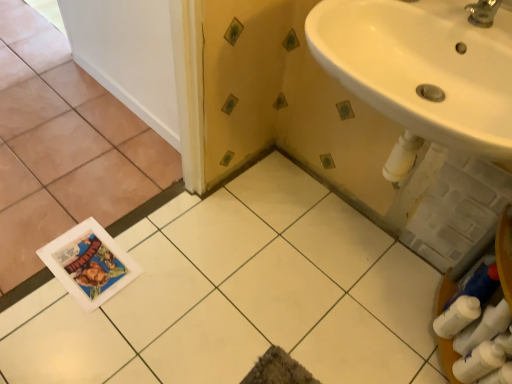
The width and height of the screenshot is (512, 384). Find the location of `free spot below white glossy sink at upper right (from a real-world perspective)`. free spot below white glossy sink at upper right (from a real-world perspective) is located at coordinates click(347, 261).